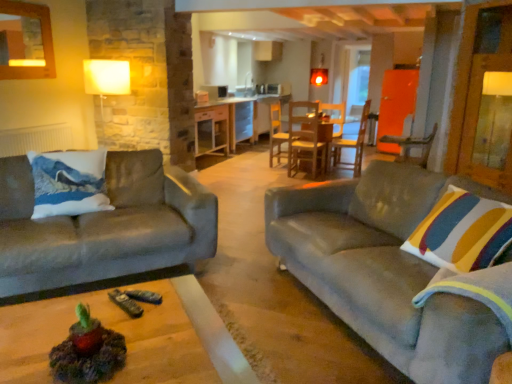
Describe the element at coordinates (35, 139) in the screenshot. This screenshot has width=512, height=384. I see `white matte radiator at left` at that location.

What do you see at coordinates (384, 269) in the screenshot? I see `velvet grey couch at right, acting as the 1th studio couch starting from the right` at bounding box center [384, 269].

Locate an element on the screen. The width and height of the screenshot is (512, 384). transparent glass door at center is located at coordinates (357, 82).

In order to click on wooden table at center in this screenshot , I will do `click(239, 120)`.

Is transparent glass door at center positioned beyond the bounds of velvet gray couch at left, arranged as the 2th studio couch when viewed from the right?

Indeed, transparent glass door at center is completely outside velvet gray couch at left, arranged as the 2th studio couch when viewed from the right.

Is the depth of transparent glass door at center greater than that of velvet gray couch at left, the 1th studio couch when ordered from left to right?

Yes, it is behind velvet gray couch at left, the 1th studio couch when ordered from left to right.

Is transparent glass door at center far from velvet gray couch at left, arranged as the 2th studio couch when viewed from the right?

Yes, transparent glass door at center and velvet gray couch at left, arranged as the 2th studio couch when viewed from the right, are quite far apart.

Between transparent glass door at center and velvet gray couch at left, the 1th studio couch when ordered from left to right, which one has larger size?

Bigger between the two is velvet gray couch at left, the 1th studio couch when ordered from left to right.

Is velvet gray couch at left, arranged as the 2th studio couch when viewed from the right, closer to camera compared to wooden table at center?

Yes, it is.

Which object is wider, velvet gray couch at left, the 1th studio couch when ordered from left to right, or wooden table at center?

With larger width is velvet gray couch at left, the 1th studio couch when ordered from left to right.

From a real-world perspective, is velvet gray couch at left, the 1th studio couch when ordered from left to right, on top of wooden table at center?

Indeed, from a real-world perspective, velvet gray couch at left, the 1th studio couch when ordered from left to right, stands above wooden table at center.

Can you see velvet gray couch at left, the 1th studio couch when ordered from left to right, touching wooden table at center?

velvet gray couch at left, the 1th studio couch when ordered from left to right, is not next to wooden table at center, and they're not touching.

Is white matte radiator at left looking in the opposite direction of wooden chair at center, which is counted as the 1th chair, starting from the left?

No, wooden chair at center, which is counted as the 1th chair, starting from the left, is not at the back of white matte radiator at left.

From the picture: Is white matte radiator at left placed right next to wooden chair at center, placed as the first chair when sorted from back to front?

There is a gap between white matte radiator at left and wooden chair at center, placed as the first chair when sorted from back to front.

Relative to wooden chair at center, placed as the first chair when sorted from back to front, is white matte radiator at left in front or behind?

white matte radiator at left is in front of wooden chair at center, placed as the first chair when sorted from back to front.

Considering the positions of point (7, 149) and point (272, 111), is point (7, 149) closer or farther from the camera than point (272, 111)?

Clearly, point (7, 149) is closer to the camera than point (272, 111).

Is wooden table at center turned away from wooden chair at right, acting as the 1th chair starting from the right?

No, wooden table at center is not facing the opposite direction of wooden chair at right, acting as the 1th chair starting from the right.

From a real-world perspective, is wooden table at center physically below wooden chair at right, the first chair when ordered from front to back?

Yes.

Would you say wooden table at center is to the left or to the right of wooden chair at right, acting as the 1th chair starting from the right, in the picture?

wooden table at center is positioned on wooden chair at right, acting as the 1th chair starting from the right,'s left side.

Does wooden table at center have a smaller size compared to white matte radiator at left?

Incorrect, wooden table at center is not smaller in size than white matte radiator at left.

Considering the sizes of wooden table at center and white matte radiator at left in the image, is wooden table at center wider or thinner than white matte radiator at left?

wooden table at center is wider than white matte radiator at left.

Choose the correct answer: Is wooden table at center inside white matte radiator at left or outside it?

wooden table at center lies outside white matte radiator at left.

How different are the orientations of white matte radiator at left and wooden table at center in degrees?

The facing directions of white matte radiator at left and wooden table at center are 0.285 degrees apart.

From a real-world perspective, relative to wooden table at center, is white matte radiator at left vertically above or below?

white matte radiator at left is above wooden table at center.

From the image's perspective, is white matte radiator at left below wooden table at center?

Yes, from the image's perspective, white matte radiator at left is below wooden table at center.

Is white matte radiator at left completely or partially outside of wooden table at center?

Indeed, white matte radiator at left is completely outside wooden table at center.

Is transparent glass door at center wider than wooden chair at right, placed as the 2th chair when sorted from back to front?

In fact, transparent glass door at center might be narrower than wooden chair at right, placed as the 2th chair when sorted from back to front.

From the image's perspective, relative to wooden chair at right, the first chair when ordered from front to back, is transparent glass door at center above or below?

transparent glass door at center is above wooden chair at right, the first chair when ordered from front to back.

Does transparent glass door at center have a smaller size compared to wooden chair at right, marked as the second chair in a left-to-right arrangement?

No.

Which studio couch is the 1st one when counting from the front of the transparent glass door at center? Please provide its 2D coordinates.

[(105, 226)]

Image resolution: width=512 pixels, height=384 pixels. In order to click on table below the velvet gray couch at left, the 1th studio couch when ordered from left to right (from a real-world perspective) in this screenshot , I will do `click(239, 120)`.

Based on their spatial positions, is velvet grey couch at right, acting as the 1th studio couch starting from the right, or wooden table at center further from wooden chair at right, acting as the 1th chair starting from the right?

Based on the image, wooden table at center appears to be further to wooden chair at right, acting as the 1th chair starting from the right.

Which object lies further to the anchor point velvet gray couch at left, arranged as the 2th studio couch when viewed from the right, velvet grey couch at right, which ranks as the 2th studio couch in left-to-right order, or wooden chair at center, which is counted as the 1th chair, starting from the left?

Based on the image, wooden chair at center, which is counted as the 1th chair, starting from the left, appears to be further to velvet gray couch at left, arranged as the 2th studio couch when viewed from the right.

Which object lies nearer to the anchor point white matte radiator at left, wooden chair at center, marked as the 2th chair in a front-to-back arrangement, or wooden table at center?

wooden table at center is positioned closer to the anchor white matte radiator at left.

When comparing their distances from wooden chair at right, acting as the 1th chair starting from the right, does velvet grey couch at right, acting as the 1th studio couch starting from the right, or transparent glass door at center seem closer?

The object closer to wooden chair at right, acting as the 1th chair starting from the right, is velvet grey couch at right, acting as the 1th studio couch starting from the right.

Looking at the image, which one is located further to velvet gray couch at left, the 1th studio couch when ordered from left to right, wooden table at center or white matte radiator at left?

wooden table at center is positioned further to the anchor velvet gray couch at left, the 1th studio couch when ordered from left to right.

Considering their positions, is white matte radiator at left positioned further to velvet gray couch at left, the 1th studio couch when ordered from left to right, than wooden table at center?

wooden table at center.

Which object lies further to the anchor point wooden chair at right, the first chair when ordered from front to back, transparent glass door at center or wooden chair at center, which is counted as the 1th chair, starting from the left?

wooden chair at center, which is counted as the 1th chair, starting from the left.

Based on their spatial positions, is velvet grey couch at right, which ranks as the 2th studio couch in left-to-right order, or wooden chair at right, the first chair when ordered from front to back, closer to wooden table at center?

wooden chair at right, the first chair when ordered from front to back, lies closer to wooden table at center than the other object.

Locate an element on the screen. studio couch between velvet grey couch at right, acting as the 1th studio couch starting from the right, and wooden table at center from front to back is located at coordinates (105, 226).

Image resolution: width=512 pixels, height=384 pixels. What are the coordinates of `table between wooden chair at right, acting as the 1th chair starting from the right, and transparent glass door at center in the front-back direction` in the screenshot? It's located at (239, 120).

You are a GUI agent. You are given a task and a screenshot of the screen. Output one action in this format:
    pyautogui.click(x=<x>, y=<y>)
    Task: Click on the table between velvet gray couch at left, arranged as the 2th studio couch when viewed from the right, and transparent glass door at center, along the z-axis
    This screenshot has width=512, height=384.
    Given the screenshot: What is the action you would take?
    pyautogui.click(x=239, y=120)

Identify the location of radiator between velvet grey couch at right, acting as the 1th studio couch starting from the right, and transparent glass door at center from front to back. (35, 139).